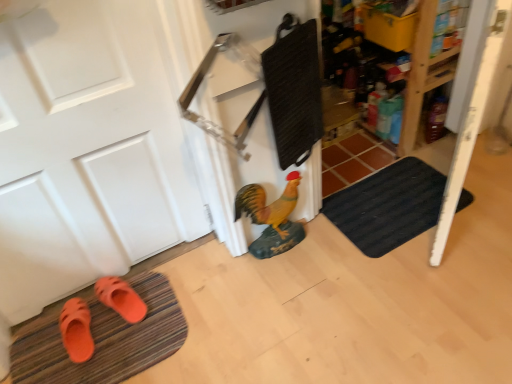
Locate an element on the screen. The height and width of the screenshot is (384, 512). vacant space to the left of orange rubber slipper at lower left, arranged as the 1th footwear when viewed from the right is located at coordinates (60, 313).